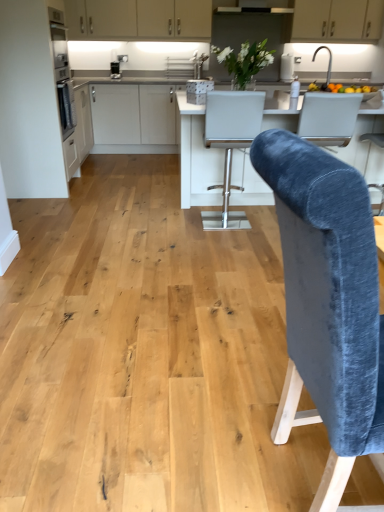
At what (x,y) coordinates should I click in order to perform the action: click on matte white cabinets at upper center, placed as the 2th cabinetry when sorted from front to back. Please return your answer as a coordinate pair (x, y). Looking at the image, I should click on (138, 19).

What do you see at coordinates (117, 66) in the screenshot? The image size is (384, 512). I see `satin black coffee machine at upper left` at bounding box center [117, 66].

Measure the distance between velvet blue armchair at right and camera.

They are 2.83 meters apart.

At what (x,y) coordinates should I click in order to perform the action: click on velvet blue armchair at right. Please return your answer as a coordinate pair (x, y). The width and height of the screenshot is (384, 512). Looking at the image, I should click on (329, 117).

Identify the location of white leather bar stool at center, the first chair positioned from the back. The width and height of the screenshot is (384, 512). (230, 143).

Describe the element at coordinates (328, 301) in the screenshot. I see `velvet blue chair at center, which is counted as the first chair, starting from the front` at that location.

The image size is (384, 512). Describe the element at coordinates (337, 20) in the screenshot. I see `white matte cabinet at upper center, marked as the 1th cabinetry in a back-to-front arrangement` at that location.

What do you see at coordinates (196, 156) in the screenshot?
I see `white glossy countertop at center` at bounding box center [196, 156].

Identify the location of matte white cabinets at upper center, the 2th cabinetry positioned from the back. The image size is (384, 512). (138, 19).

In terms of width, does satin black coffee machine at upper left look wider or thinner when compared to white leather bar stool at center, the 2th chair when ordered from bottom to top?

In the image, satin black coffee machine at upper left appears to be more narrow than white leather bar stool at center, the 2th chair when ordered from bottom to top.

Choose the correct answer: Is satin black coffee machine at upper left inside white leather bar stool at center, which is the second chair from front to back, or outside it?

The correct answer is: outside.

Is satin black coffee machine at upper left beside white leather bar stool at center, which is the second chair from front to back?

No.

Is white matte cabinetry at left, the first cabinetry when ordered from front to back, completely or partially inside satin black coffee machine at upper left?

No, white matte cabinetry at left, the first cabinetry when ordered from front to back, is located outside of satin black coffee machine at upper left.

Where is `kitchen appliance positioned vertically above the white matte cabinetry at left, which is counted as the first cabinetry, starting from the left (from a real-world perspective)`? The height and width of the screenshot is (512, 384). kitchen appliance positioned vertically above the white matte cabinetry at left, which is counted as the first cabinetry, starting from the left (from a real-world perspective) is located at coordinates (117, 66).

Considering the sizes of satin black coffee machine at upper left and white matte cabinetry at left, marked as the third cabinetry in a right-to-left arrangement, in the image, is satin black coffee machine at upper left taller or shorter than white matte cabinetry at left, marked as the third cabinetry in a right-to-left arrangement,?

In the image, satin black coffee machine at upper left appears to be shorter than white matte cabinetry at left, marked as the third cabinetry in a right-to-left arrangement.

Would you consider satin black coffee machine at upper left to be distant from white matte cabinetry at left, marked as the third cabinetry in a right-to-left arrangement?

Yes, satin black coffee machine at upper left and white matte cabinetry at left, marked as the third cabinetry in a right-to-left arrangement, are quite far apart.

Could you tell me if matte white cabinets at upper center, which appears as the 2th cabinetry when ordered from the bottom, is facing white leather bar stool at center, which is the second chair from front to back?

No.

Is matte white cabinets at upper center, placed as the 2th cabinetry when sorted from front to back, surrounding white leather bar stool at center, which is the second chair from front to back?

No, matte white cabinets at upper center, placed as the 2th cabinetry when sorted from front to back, does not contain white leather bar stool at center, which is the second chair from front to back.

Which object is closer to the camera, matte white cabinets at upper center, which appears as the 2th cabinetry when ordered from the bottom, or white leather bar stool at center, which is the second chair from front to back?

white leather bar stool at center, which is the second chair from front to back.

Considering the sizes of objects matte white cabinets at upper center, the 2th cabinetry viewed from the top, and white leather bar stool at center, which ranks as the first chair in top-to-bottom order, in the image provided, who is wider, matte white cabinets at upper center, the 2th cabinetry viewed from the top, or white leather bar stool at center, which ranks as the first chair in top-to-bottom order,?

white leather bar stool at center, which ranks as the first chair in top-to-bottom order.

Who is smaller, white leather bar stool at center, the first chair positioned from the back, or white glossy countertop at center?

white leather bar stool at center, the first chair positioned from the back, is smaller.

Which of these two, white leather bar stool at center, which is the second chair from front to back, or white glossy countertop at center, is wider?

With larger width is white glossy countertop at center.

Find the location of a particular element. countertop lying behind the white leather bar stool at center, which is the second chair from front to back is located at coordinates (196, 156).

Could you tell me if white leather bar stool at center, the first chair positioned from the back, is turned towards white glossy countertop at center?

Yes, white leather bar stool at center, the first chair positioned from the back, faces towards white glossy countertop at center.

Is point (299, 304) positioned in front of point (335, 17)?

Yes, it is in front of point (335, 17).

In the scene shown: Is the depth of velvet blue chair at center, positioned as the second chair in top-to-bottom order, greater than that of white matte cabinet at upper center, placed as the third cabinetry when sorted from bottom to top?

No, it is in front of white matte cabinet at upper center, placed as the third cabinetry when sorted from bottom to top.

From their relative heights in the image, would you say velvet blue chair at center, which is counted as the first chair, starting from the front, is taller or shorter than white matte cabinet at upper center, the third cabinetry from the left?

velvet blue chair at center, which is counted as the first chair, starting from the front, is taller than white matte cabinet at upper center, the third cabinetry from the left.

Which of these two, velvet blue chair at center, positioned as the second chair in top-to-bottom order, or white matte cabinet at upper center, marked as the 1th cabinetry in a back-to-front arrangement, is wider?

Wider between the two is velvet blue chair at center, positioned as the second chair in top-to-bottom order.

Are white matte cabinet at upper center, arranged as the third cabinetry when viewed from the front, and velvet blue armchair at right located far from each other?

white matte cabinet at upper center, arranged as the third cabinetry when viewed from the front, is positioned a significant distance from velvet blue armchair at right.

Which point is more forward, (333, 37) or (308, 138)?

The point (308, 138) is more forward.

Does white matte cabinet at upper center, marked as the 1th cabinetry in a top-to-bottom arrangement, come in front of velvet blue armchair at right?

No, white matte cabinet at upper center, marked as the 1th cabinetry in a top-to-bottom arrangement, is further to the viewer.

Looking at this image, what's the angular difference between white matte cabinet at upper center, marked as the 1th cabinetry in a top-to-bottom arrangement, and velvet blue armchair at right's facing directions?

178 degrees separate the facing orientations of white matte cabinet at upper center, marked as the 1th cabinetry in a top-to-bottom arrangement, and velvet blue armchair at right.

Is velvet blue chair at center, which appears as the 2th chair when viewed from the back, next to satin black coffee machine at upper left?

No, velvet blue chair at center, which appears as the 2th chair when viewed from the back, is not beside satin black coffee machine at upper left.

Considering the positions of points (279, 194) and (118, 78), is point (279, 194) closer to camera compared to point (118, 78)?

Yes, it is.

From the image's perspective, which one is positioned higher, velvet blue chair at center, positioned as the second chair in top-to-bottom order, or satin black coffee machine at upper left?

satin black coffee machine at upper left, from the image's perspective.

Starting from the satin black coffee machine at upper left, which chair is the 1st one in front? Please provide its 2D coordinates.

[(230, 143)]

At what (x,y) coordinates should I click in order to perform the action: click on kitchen appliance above the white matte cabinetry at left, the first cabinetry when ordered from front to back (from a real-world perspective). Please return your answer as a coordinate pair (x, y). Image resolution: width=384 pixels, height=512 pixels. Looking at the image, I should click on (x=117, y=66).

From the image, which object appears to be farther from velvet blue armchair at right, white matte cabinet at upper center, marked as the 1th cabinetry in a top-to-bottom arrangement, or white matte cabinetry at left, which is the 1th cabinetry in bottom-to-top order?

white matte cabinet at upper center, marked as the 1th cabinetry in a top-to-bottom arrangement, is positioned further to the anchor velvet blue armchair at right.

Estimate the real-world distances between objects in this image. Which object is closer to white matte cabinetry at left, marked as the third cabinetry in a right-to-left arrangement, satin black coffee machine at upper left or white matte cabinet at upper center, placed as the third cabinetry when sorted from bottom to top?

Based on the image, satin black coffee machine at upper left appears to be nearer to white matte cabinetry at left, marked as the third cabinetry in a right-to-left arrangement.

Looking at the image, which one is located further to white leather bar stool at center, which is the second chair from front to back, white glossy countertop at center or velvet blue chair at center, positioned as the second chair in top-to-bottom order?

velvet blue chair at center, positioned as the second chair in top-to-bottom order, is further to white leather bar stool at center, which is the second chair from front to back.

When comparing their distances from satin black coffee machine at upper left, does velvet blue chair at center, which appears as the 2th chair when viewed from the back, or matte white cabinets at upper center, the 2th cabinetry positioned from the back, seem further?

velvet blue chair at center, which appears as the 2th chair when viewed from the back.

Estimate the real-world distances between objects in this image. Which object is further from white matte cabinet at upper center, arranged as the 1th cabinetry when viewed from the right, matte white cabinets at upper center, placed as the 2th cabinetry when sorted from front to back, or white glossy countertop at center?

The object further to white matte cabinet at upper center, arranged as the 1th cabinetry when viewed from the right, is white glossy countertop at center.

Looking at the image, which one is located further to white glossy countertop at center, white matte cabinetry at left, the first cabinetry when ordered from front to back, or white leather bar stool at center, the first chair positioned from the back?

white matte cabinetry at left, the first cabinetry when ordered from front to back, lies further to white glossy countertop at center than the other object.

Looking at the image, which one is located closer to satin black coffee machine at upper left, white leather bar stool at center, the 2th chair when ordered from bottom to top, or velvet blue chair at center, which is counted as the first chair, starting from the front?

white leather bar stool at center, the 2th chair when ordered from bottom to top, is positioned closer to the anchor satin black coffee machine at upper left.

Looking at the image, which one is located closer to white matte cabinet at upper center, arranged as the 1th cabinetry when viewed from the right, velvet blue armchair at right or white leather bar stool at center, the 2th chair when ordered from bottom to top?

velvet blue armchair at right is closer to white matte cabinet at upper center, arranged as the 1th cabinetry when viewed from the right.

The image size is (384, 512). I want to click on chair between velvet blue chair at center, positioned as the second chair in top-to-bottom order, and white glossy countertop at center from front to back, so click(230, 143).

You are a GUI agent. You are given a task and a screenshot of the screen. Output one action in this format:
    pyautogui.click(x=<x>, y=<y>)
    Task: Click on the cabinetry between white matte cabinetry at left, which is counted as the first cabinetry, starting from the left, and velvet blue armchair at right
    The image size is (384, 512).
    Given the screenshot: What is the action you would take?
    pyautogui.click(x=138, y=19)

Where is `chair located between velvet blue chair at center, which appears as the 2th chair when viewed from the back, and velvet blue armchair at right in the depth direction`? The width and height of the screenshot is (384, 512). chair located between velvet blue chair at center, which appears as the 2th chair when viewed from the back, and velvet blue armchair at right in the depth direction is located at coordinates (230, 143).

Find the location of a particular element. armchair between velvet blue chair at center, positioned as the second chair in top-to-bottom order, and white matte cabinetry at left, which is the 1th cabinetry in bottom-to-top order, in the front-back direction is located at coordinates (329, 117).